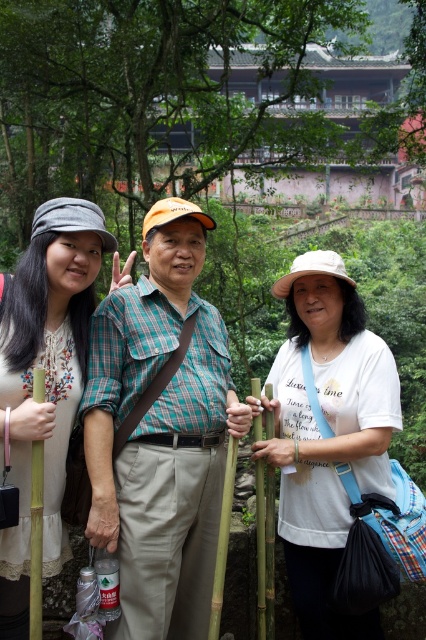
From the picture: Which of these two, white cotton hat at center or green bamboo pole at center, stands taller?

white cotton hat at center

Between point (336, 346) and point (261, 529), which one is positioned behind?

Positioned behind is point (336, 346).

The height and width of the screenshot is (640, 426). Identify the location of white cotton hat at center. (327, 438).

From the picture: Between white cotton hat at center and matte white blouse at left, which one is positioned higher?

Positioned higher is matte white blouse at left.

Is point (282, 461) less distant than point (86, 301)?

Yes, it is.

Identify the location of white cotton hat at center. The height and width of the screenshot is (640, 426). (327, 438).

Identify the location of white cotton hat at center. (327, 438).

Which of these two, matte white blouse at left or green bamboo pole at left, stands taller?

matte white blouse at left is taller.

Does matte white blouse at left come behind green bamboo pole at left?

Yes, it is.

Identify the location of matte white blouse at left. (46, 378).